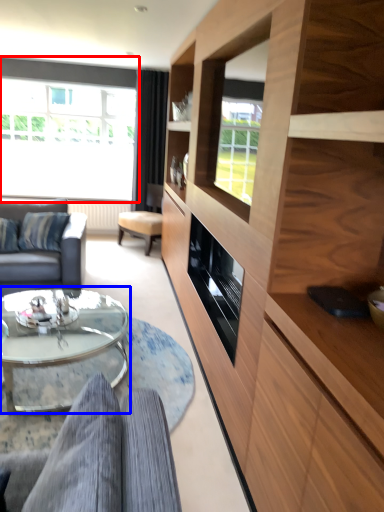
Question: Which object appears closest to the camera in this image, window (highlighted by a red box) or coffee table (highlighted by a blue box)?

Choices:
 (A) window
 (B) coffee table

Answer: (B)